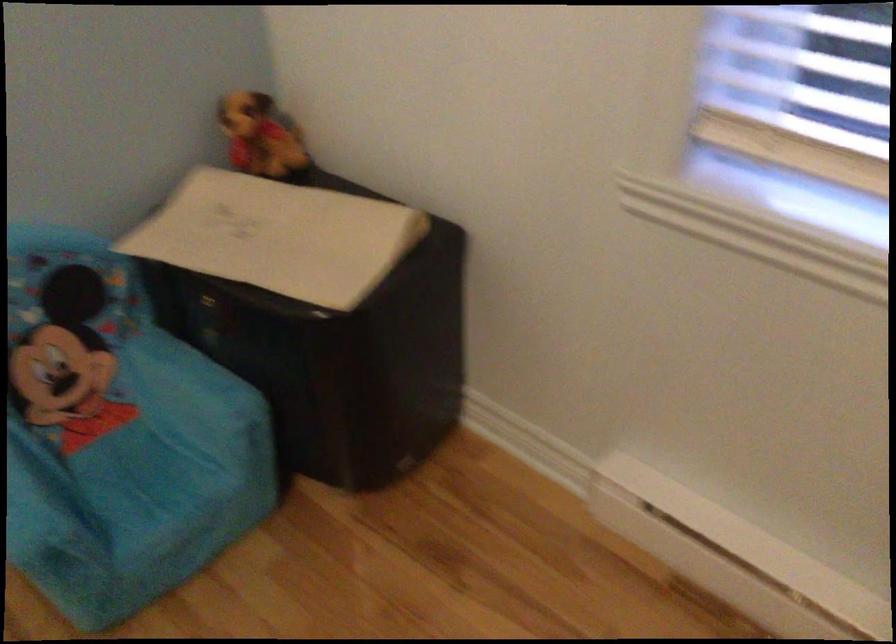
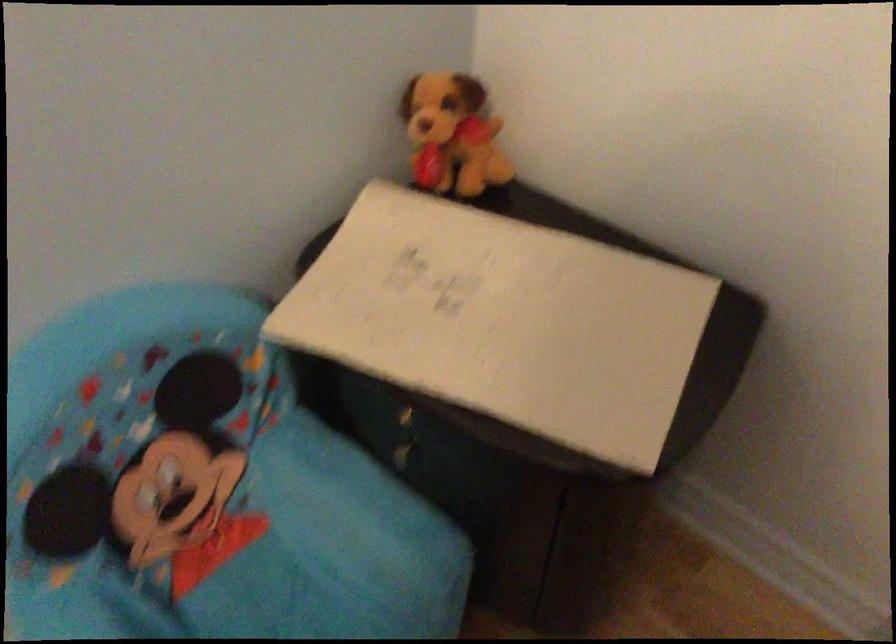
Locate, in the second image, the point that corresponds to the point at 212,327 in the first image.

(403, 438)